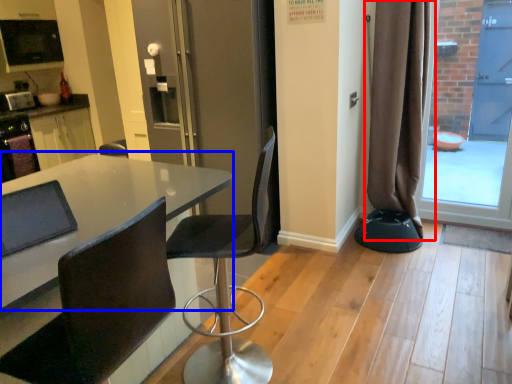
Question: Which point is closer to the camera, curtain (highlighted by a red box) or table (highlighted by a blue box)?

Choices:
 (A) curtain
 (B) table

Answer: (B)